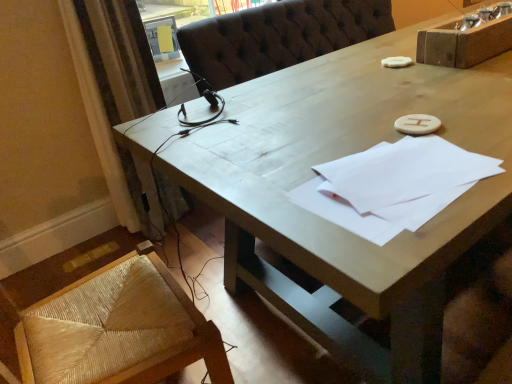
Find the location of a particular element. The image size is (512, 384). vacant space behind white paper at center is located at coordinates (348, 134).